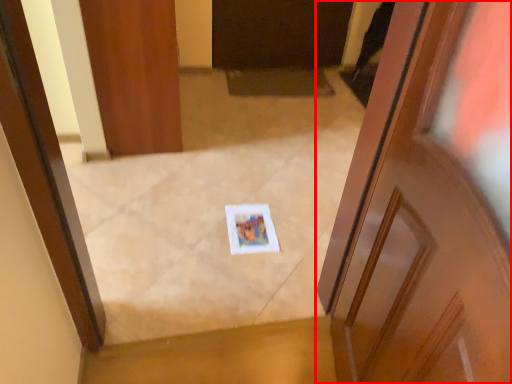
Question: From the image's perspective, what is the correct spatial relationship of door (annotated by the red box) in relation to door?

Choices:
 (A) above
 (B) below

Answer: (B)